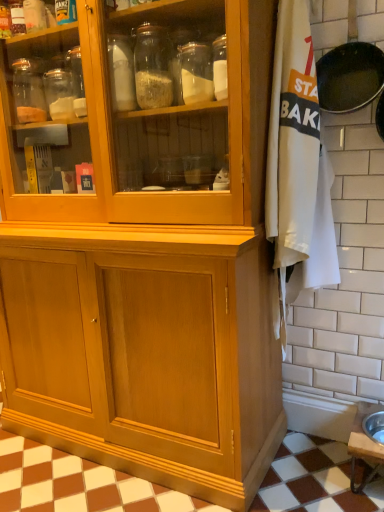
Measure the distance between black non-stick frying pan at upper right and camera.

They are 1.25 meters apart.

What do you see at coordinates (350, 77) in the screenshot? I see `black non-stick frying pan at upper right` at bounding box center [350, 77].

This screenshot has height=512, width=384. I want to click on black non-stick frying pan at upper right, so click(x=350, y=77).

Locate an element on the screen. black non-stick frying pan at upper right is located at coordinates [x=350, y=77].